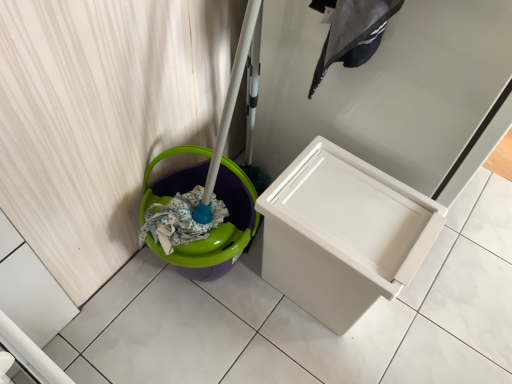
Question: Would you say dark gray fabric laundry at upper center is inside or outside white plastic drawer at center?

Choices:
 (A) outside
 (B) inside

Answer: (A)

Question: From the image's perspective, is dark gray fabric laundry at upper center positioned above or below white plastic drawer at center?

Choices:
 (A) above
 (B) below

Answer: (B)

Question: Which object is the closest to the white plastic waste container at center?

Choices:
 (A) white plastic drawer at center
 (B) dark gray fabric laundry at upper center

Answer: (A)

Question: Estimate the real-world distances between objects in this image. Which object is closer to the dark gray fabric laundry at upper center?

Choices:
 (A) white plastic drawer at center
 (B) white plastic waste container at center

Answer: (A)